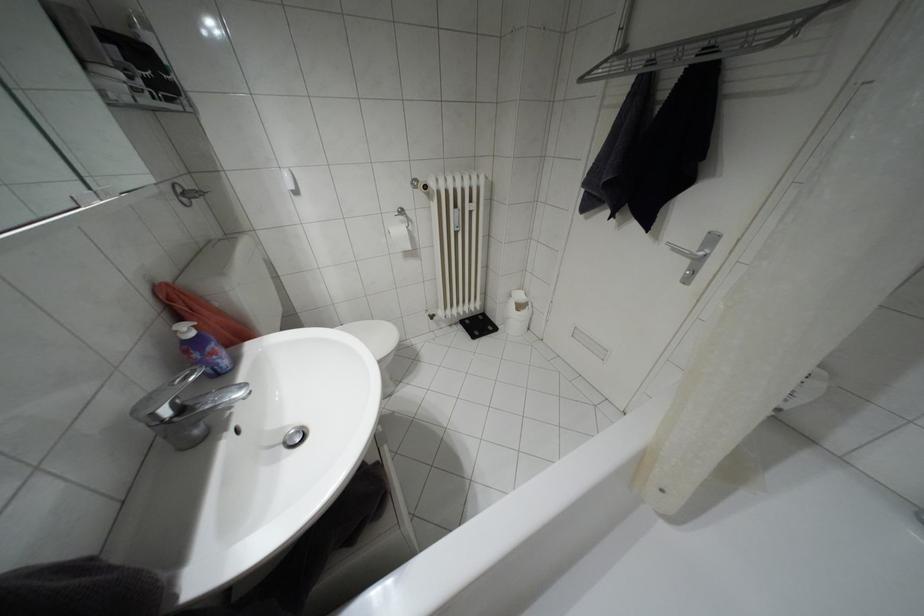
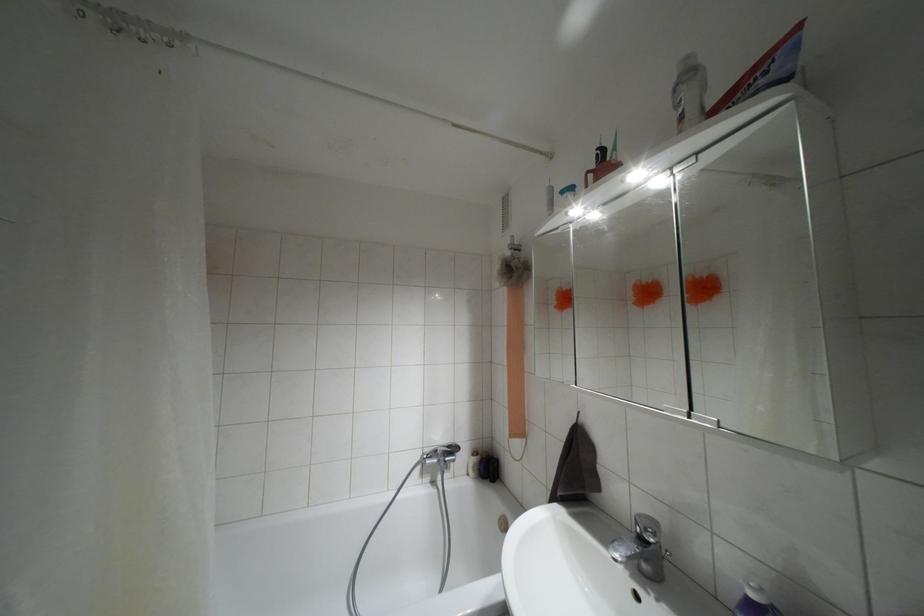
In the second image, find the point that corresponds to point (180, 408) in the first image.

(641, 538)